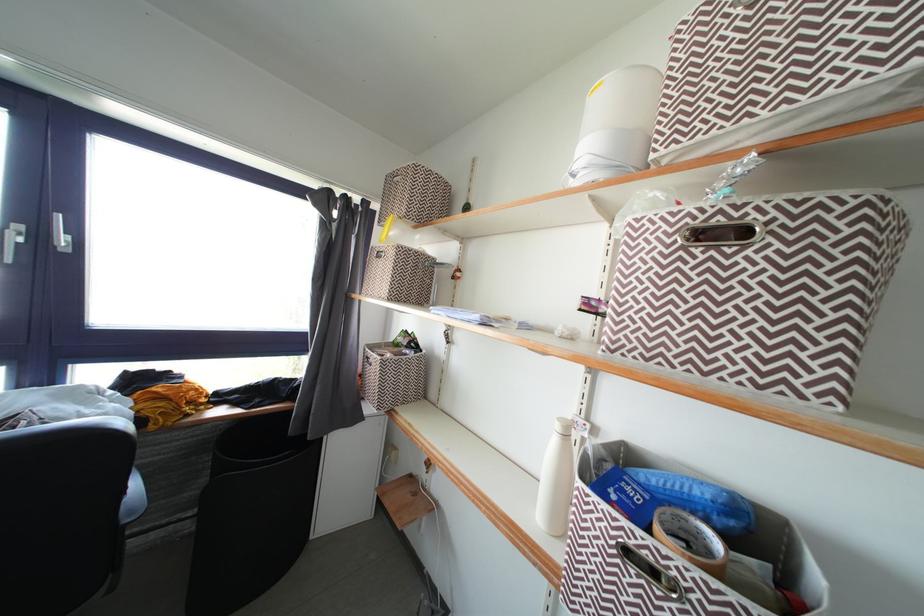
Find where to pull the storage bin handle. Please return your answer as a coordinate pair (x, y).

(392, 376)